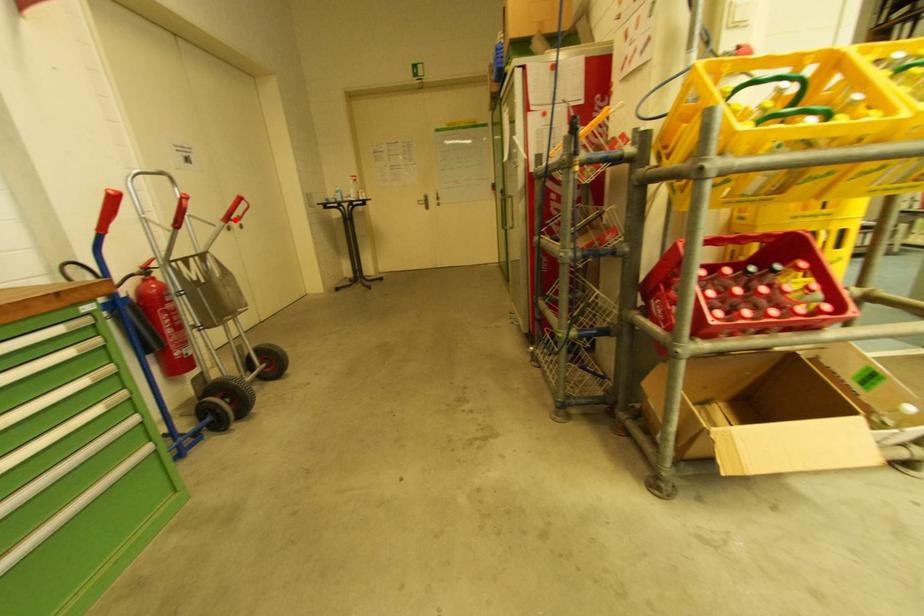
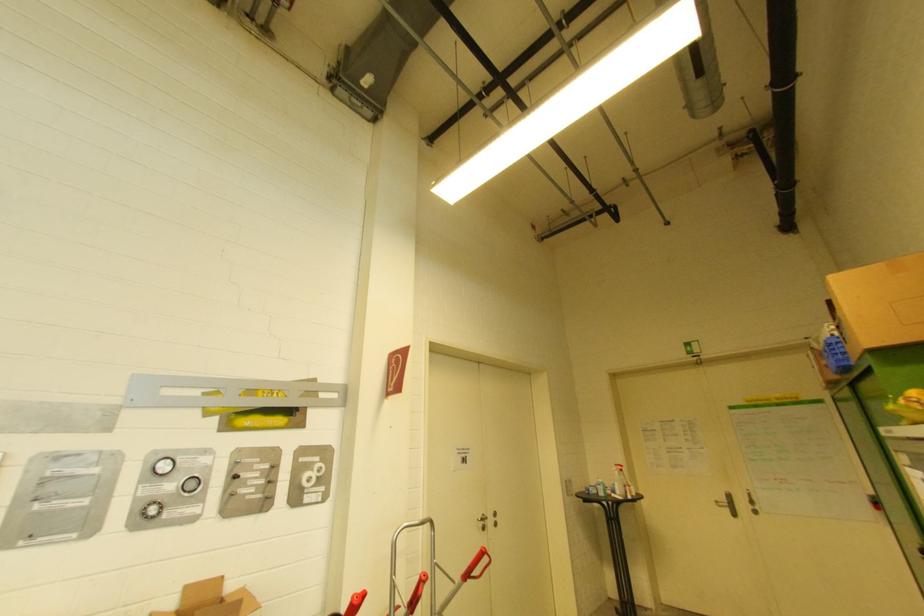
Locate, in the second image, the point that corresponds to the highlighted location in the first image.

(475, 575)